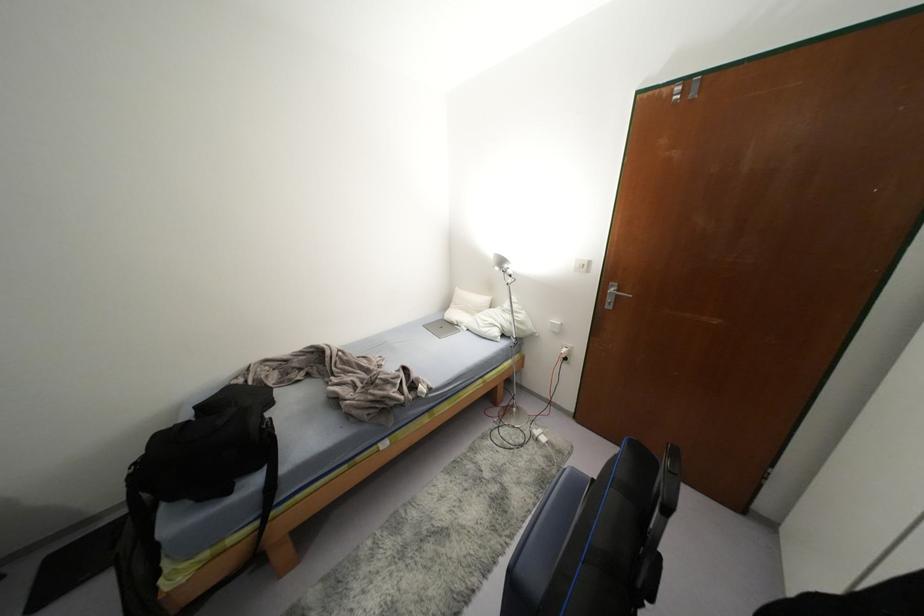
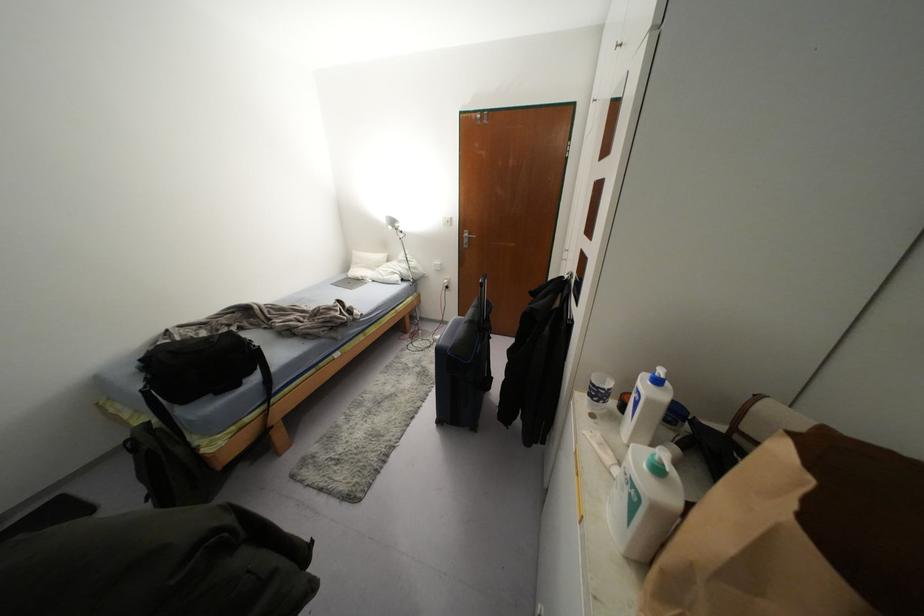
The point at (x=484, y=299) is marked in the first image. Where is the corresponding point in the second image?

(382, 256)